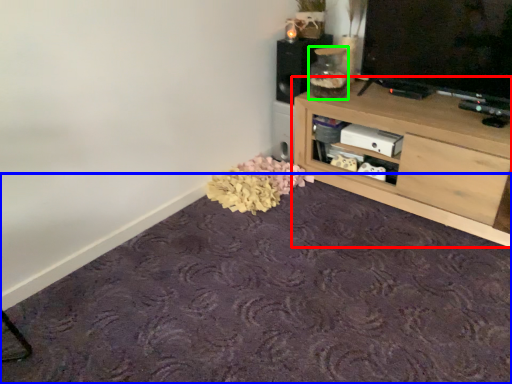
Question: Which object is positioned farthest from shelf (highlighted by a red box)? Select from plain (highlighted by a blue box) and glass jar (highlighted by a green box).

Choices:
 (A) plain
 (B) glass jar

Answer: (A)